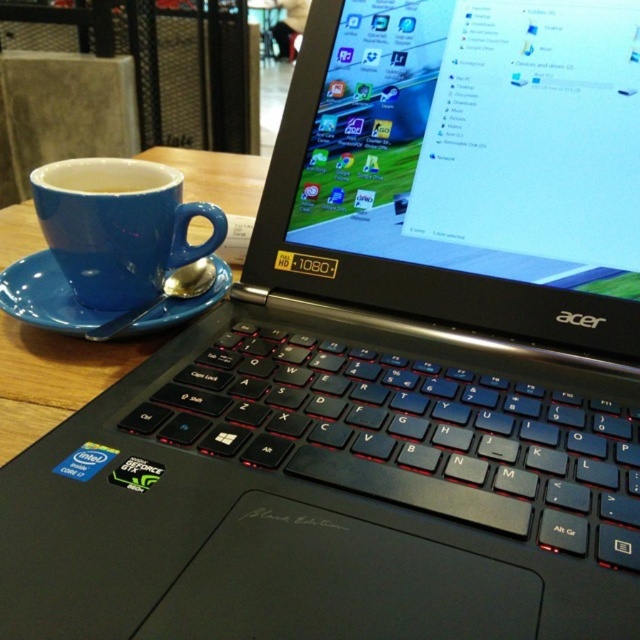
Question: Is matte blue mug at left behind blue ceramic cup at left?

Choices:
 (A) no
 (B) yes

Answer: (B)

Question: Is blue ceramic cup at left above blue matte saucer at left?

Choices:
 (A) yes
 (B) no

Answer: (A)

Question: Which point appears farthest from the camera in this image?

Choices:
 (A) (120, 280)
 (B) (106, 324)

Answer: (A)

Question: Does matte blue mug at left come in front of blue ceramic cup at left?

Choices:
 (A) no
 (B) yes

Answer: (A)

Question: Which object appears farthest from the camera in this image?

Choices:
 (A) blue ceramic cup at left
 (B) matte blue mug at left

Answer: (B)

Question: Which point is farther to the camera?

Choices:
 (A) (230, 188)
 (B) (113, 236)
 (C) (35, 266)

Answer: (A)